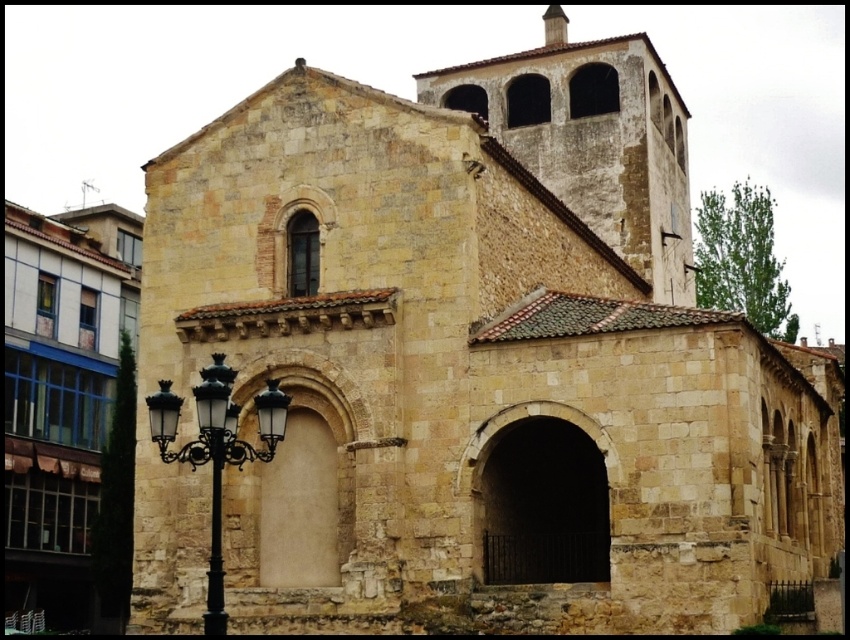
From the picture: You are standing in front of the church and want to take a photo that includes both the beige stone church at left and the black wrought iron streetlight at lower left. Which object should you ensure is framed first to avoid cropping due to their height difference?

The beige stone church at left is taller than the black wrought iron streetlight at lower left. To avoid cropping, frame the taller beige stone church at left first in your photo composition.

You are a pedestrian standing on the sidewalk in front of the church. You notice the beige stone church at left and the black wrought iron streetlight at lower left. Which object is positioned higher relative to the other?

The beige stone church at left is above the black wrought iron streetlight at lower left, so the church is higher.

You are standing at the point marked by coordinates point [61,396]. Based on the scene, what is the closest object to your current position?

The beige stone church at left is represented by point [61,396], so the closest object to your current position is the beige stone church at left.